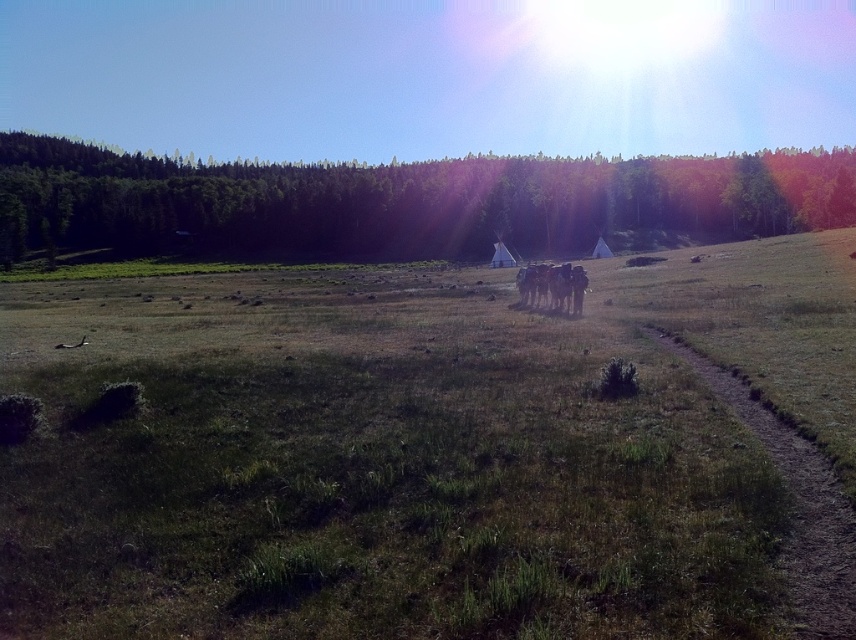
Question: Where is green leafy tree at upper center located in relation to brown woolen herd at center in the image?

Choices:
 (A) above
 (B) below

Answer: (A)

Question: Which point is closer to the camera?

Choices:
 (A) (580, 312)
 (B) (180, 211)

Answer: (A)

Question: Can you confirm if green leafy tree at upper center is bigger than brown woolen herd at center?

Choices:
 (A) yes
 (B) no

Answer: (A)

Question: Is green leafy tree at upper center above brown woolen herd at center?

Choices:
 (A) no
 (B) yes

Answer: (B)

Question: Which object is farther from the camera taking this photo?

Choices:
 (A) green leafy tree at upper center
 (B) brown woolen herd at center

Answer: (A)